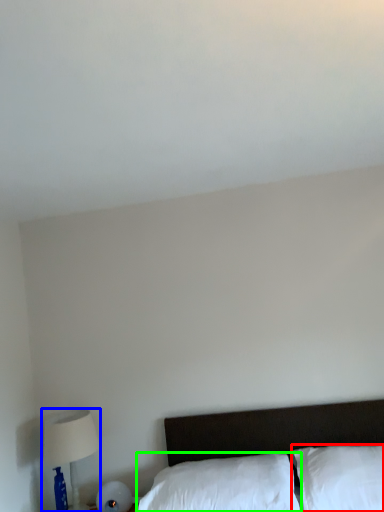
Question: Estimate the real-world distances between objects in this image. Which object is farther from pillow (highlighted by a red box), table lamp (highlighted by a blue box) or pillow (highlighted by a green box)?

Choices:
 (A) table lamp
 (B) pillow

Answer: (A)